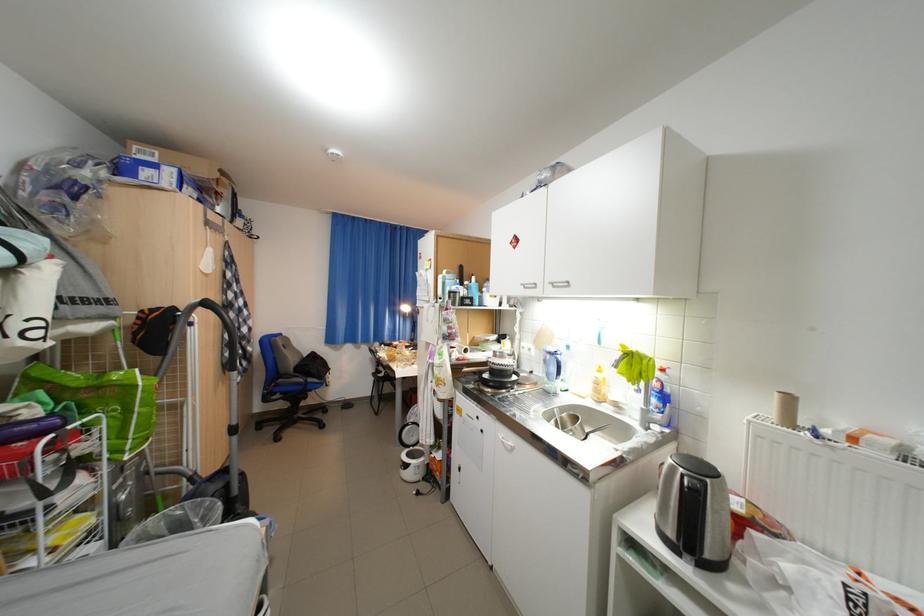
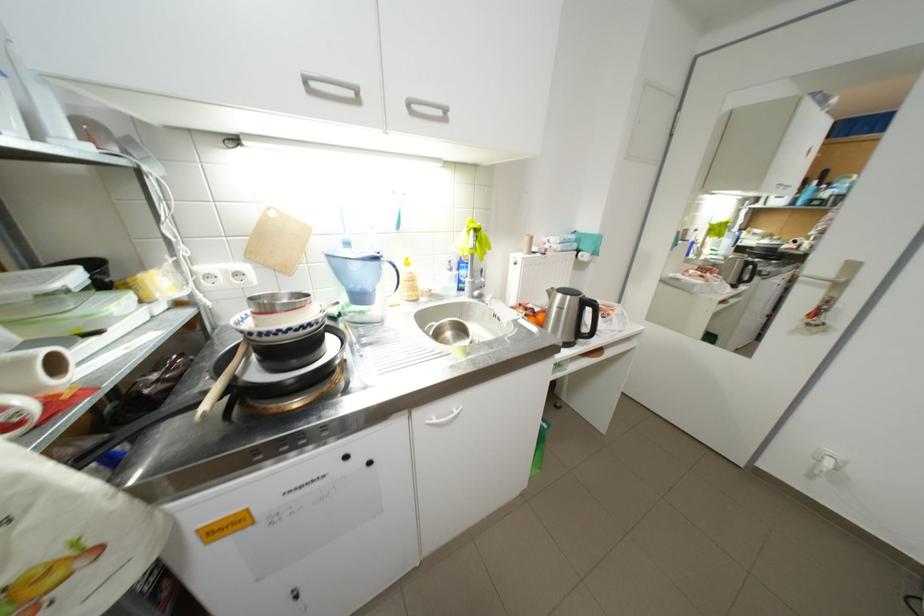
In the second image, find the point that corresponds to pixel 546 344 in the first image.

(262, 256)